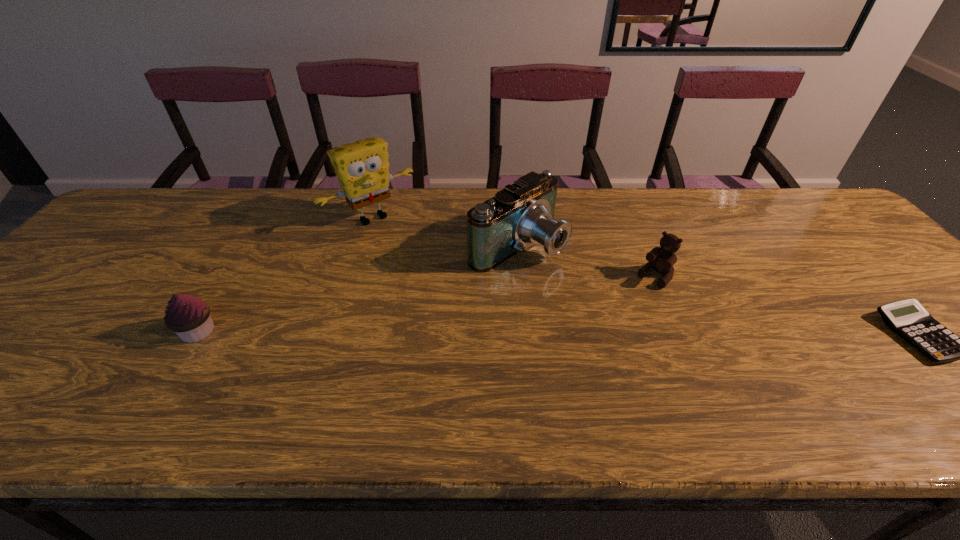
Where is `vacant space situated 0.360m on the face of the tallest object`? vacant space situated 0.360m on the face of the tallest object is located at coordinates (463, 307).

I want to click on free spot located 0.090m on the face of the tallest object, so pyautogui.click(x=408, y=249).

This screenshot has width=960, height=540. Find the location of `vacant space positioned 0.400m on the face of the tallest object`. vacant space positioned 0.400m on the face of the tallest object is located at coordinates (472, 318).

Where is `free space located on the front-facing side of the third object from right to left`? This screenshot has width=960, height=540. free space located on the front-facing side of the third object from right to left is located at coordinates (653, 326).

Identify the location of free space located 0.320m on the front-facing side of the third object from right to left. This screenshot has width=960, height=540. point(664,333).

The width and height of the screenshot is (960, 540). I want to click on vacant area situated on the front-facing side of the third object from right to left, so click(x=657, y=328).

What are the coordinates of `sponge located in the far edge section of the desktop` in the screenshot? It's located at (362, 167).

Locate an element on the screen. camcorder located in the far edge section of the desktop is located at coordinates (522, 213).

Locate an element on the screen. free location at the far edge is located at coordinates (601, 214).

Identify the location of free space at the near edge of the desktop. The height and width of the screenshot is (540, 960). (614, 369).